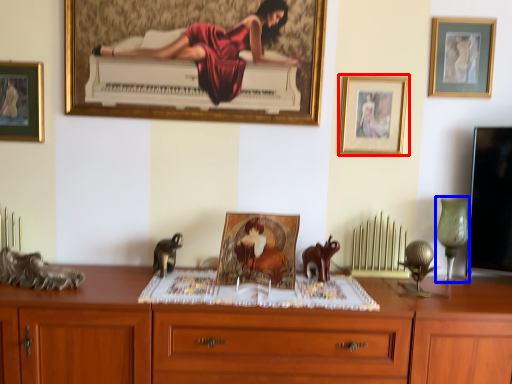
Question: Which point is closer to the camera, picture frame (highlighted by a red box) or table lamp (highlighted by a blue box)?

Choices:
 (A) picture frame
 (B) table lamp

Answer: (B)